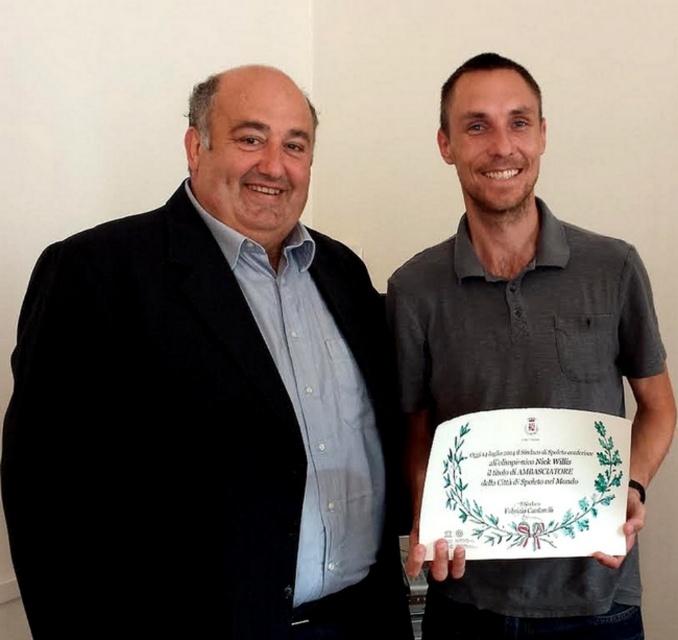
Question: Is matte black suit at left to the right of gray cotton polo shirt at center from the viewer's perspective?

Choices:
 (A) no
 (B) yes

Answer: (A)

Question: Does matte black suit at left come behind gray cotton polo shirt at center?

Choices:
 (A) no
 (B) yes

Answer: (A)

Question: Among these points, which one is farthest from the camera?

Choices:
 (A) (73, 304)
 (B) (504, 177)

Answer: (B)

Question: Which of the following is the farthest from the observer?

Choices:
 (A) gray cotton polo shirt at center
 (B) matte black suit at left

Answer: (A)

Question: Which point is closer to the camera?

Choices:
 (A) gray cotton polo shirt at center
 (B) matte black suit at left

Answer: (B)

Question: Is matte black suit at left positioned at the back of gray cotton polo shirt at center?

Choices:
 (A) yes
 (B) no

Answer: (B)